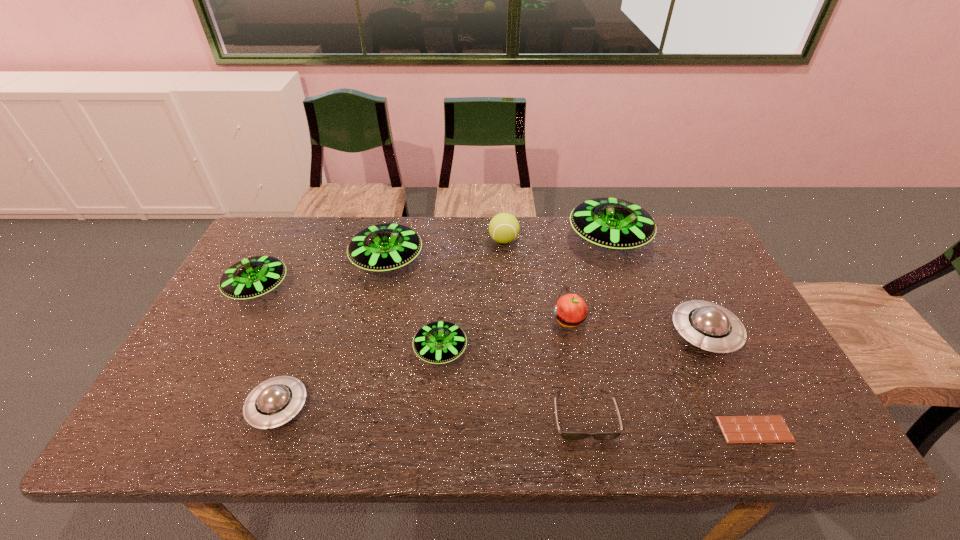
I want to click on empty location between the bigger gray saucer and the leftmost green saucer, so click(x=482, y=310).

Where is `object that can be found as the closest to the fifth shortest saucer`? object that can be found as the closest to the fifth shortest saucer is located at coordinates (253, 277).

What are the coordinates of `the ninth closest object to the tallest saucer` in the screenshot? It's located at (253, 277).

Point out which saucer is positioned as the third nearest to the nearest saucer. Please provide its 2D coordinates. Your answer should be formatted as a tuple, i.e. [(x, y)], where the tuple contains the x and y coordinates of a point satisfying the conditions above.

[(384, 247)]

Identify which saucer is the second nearest to the second green saucer from right to left. Please provide its 2D coordinates. Your answer should be formatted as a tuple, i.e. [(x, y)], where the tuple contains the x and y coordinates of a point satisfying the conditions above.

[(274, 402)]

Where is `the third closest green saucer to the smaller gray saucer`? The image size is (960, 540). the third closest green saucer to the smaller gray saucer is located at coordinates (384, 247).

Locate which green saucer is the fourth closest to the apple. Please provide its 2D coordinates. Your answer should be formatted as a tuple, i.e. [(x, y)], where the tuple contains the x and y coordinates of a point satisfying the conditions above.

[(253, 277)]

Identify the location of free space that satisfies the following two spatial constraints: 1. on the back side of the apple; 2. on the right side of the smaller gray saucer. (310, 320).

Locate an element on the screen. vacant space that satisfies the following two spatial constraints: 1. on the front-facing side of the black sunglasses; 2. on the right side of the shortest object is located at coordinates (587, 429).

Where is `free region that satisfies the following two spatial constraints: 1. on the back side of the smaller gray saucer; 2. on the right side of the bigger gray saucer`? The height and width of the screenshot is (540, 960). free region that satisfies the following two spatial constraints: 1. on the back side of the smaller gray saucer; 2. on the right side of the bigger gray saucer is located at coordinates (305, 333).